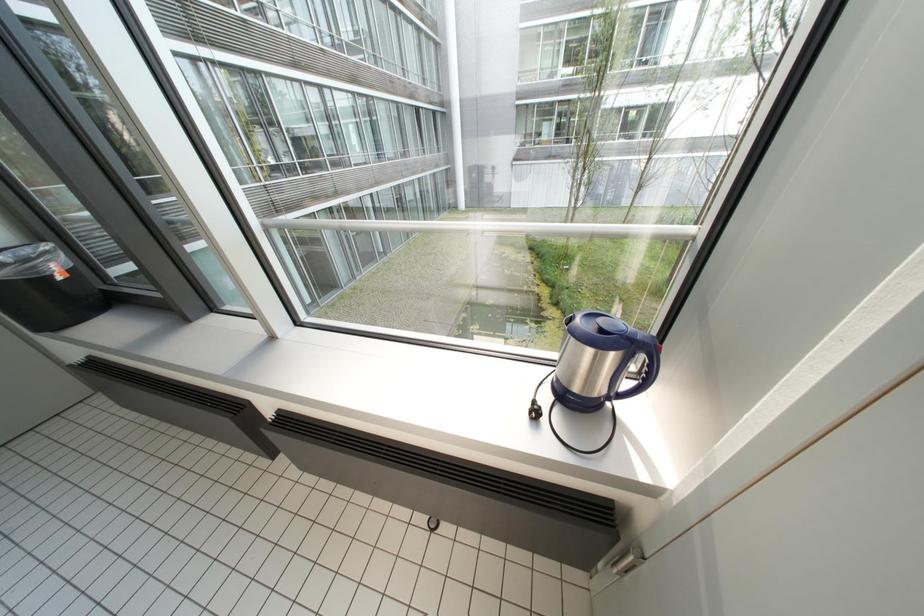
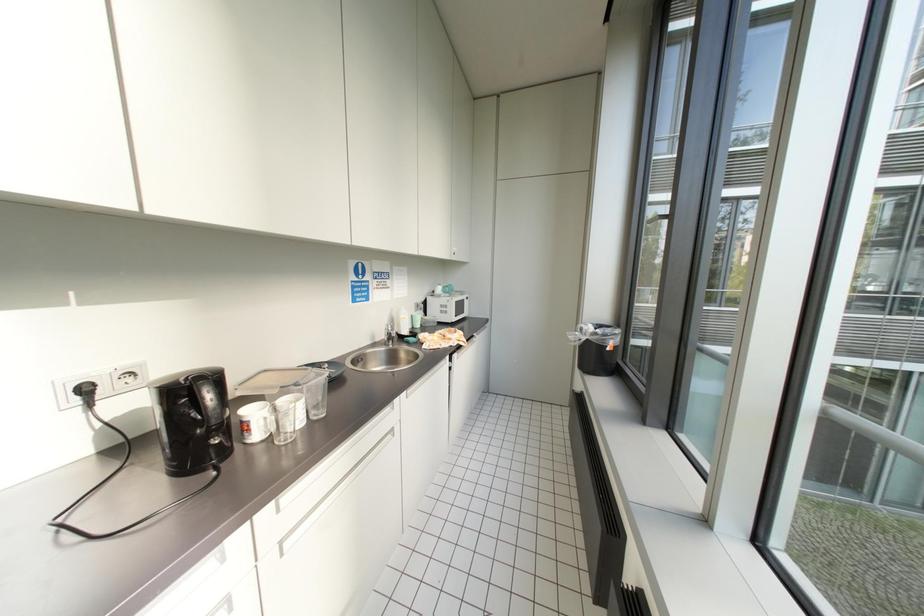
Question: The camera is either moving clockwise (left) or counter-clockwise (right) around the object. The first image is from the beginning of the video and the second image is from the end. Is the camera moving left or right when shooting the video?

Choices:
 (A) Left
 (B) Right

Answer: (B)